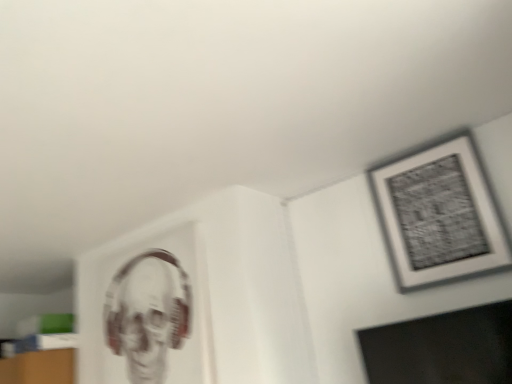
Describe the element at coordinates (439, 215) in the screenshot. I see `gray matte picture frame at upper right` at that location.

Find the location of a particular element. gray matte picture frame at upper right is located at coordinates (439, 215).

Measure the distance between point (x=438, y=278) and camera.

The depth of point (x=438, y=278) is 5.27 feet.

This screenshot has width=512, height=384. I want to click on gray matte picture frame at upper right, so tap(439, 215).